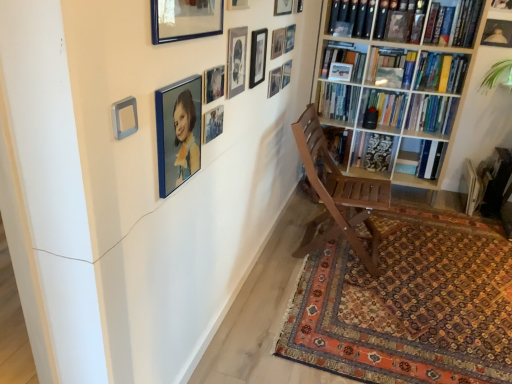
Question: Can you confirm if matte black picture frame at upper center, the 6th picture frame viewed from the right, is wider than matte black picture frame at upper center, which appears as the 12th picture frame when viewed from the left?

Choices:
 (A) no
 (B) yes

Answer: (A)

Question: Is matte black picture frame at upper center, the 6th picture frame viewed from the right, in contact with matte black picture frame at upper center, the third picture frame viewed from the right?

Choices:
 (A) no
 (B) yes

Answer: (A)

Question: Is matte black picture frame at upper center, the 6th picture frame viewed from the right, positioned with its back to matte black picture frame at upper center, which appears as the 12th picture frame when viewed from the left?

Choices:
 (A) yes
 (B) no

Answer: (B)

Question: Is matte black picture frame at upper center, positioned as the ninth picture frame in left-to-right order, completely or partially outside of matte black picture frame at upper center, the third picture frame viewed from the right?

Choices:
 (A) no
 (B) yes

Answer: (B)

Question: Is matte black picture frame at upper center, the 6th picture frame viewed from the right, thinner than matte black picture frame at upper center, the third picture frame viewed from the right?

Choices:
 (A) yes
 (B) no

Answer: (A)

Question: Is matte black picture frame at upper center, the 6th picture frame viewed from the right, positioned before matte black picture frame at upper center, which appears as the 12th picture frame when viewed from the left?

Choices:
 (A) no
 (B) yes

Answer: (B)

Question: Is matte black picture frame at upper center, the third picture frame viewed from the right, thinner than hardcover book at upper right, which appears as the 2th book when ordered from the bottom?

Choices:
 (A) no
 (B) yes

Answer: (B)

Question: Can you confirm if matte black picture frame at upper center, which appears as the 12th picture frame when viewed from the left, is shorter than hardcover book at upper right, which appears as the 2th book when ordered from the bottom?

Choices:
 (A) no
 (B) yes

Answer: (B)

Question: Is hardcover book at upper right, which is the 3th book in top-to-bottom order, inside matte black picture frame at upper center, the third picture frame viewed from the right?

Choices:
 (A) no
 (B) yes

Answer: (A)

Question: From a real-world perspective, is matte black picture frame at upper center, the third picture frame viewed from the right, on hardcover book at upper right, which is the 3th book in top-to-bottom order?

Choices:
 (A) yes
 (B) no

Answer: (A)

Question: Considering the relative sizes of matte black picture frame at upper center, which appears as the 12th picture frame when viewed from the left, and hardcover book at upper right, which is the 3th book in top-to-bottom order, in the image provided, is matte black picture frame at upper center, which appears as the 12th picture frame when viewed from the left, bigger than hardcover book at upper right, which is the 3th book in top-to-bottom order,?

Choices:
 (A) yes
 (B) no

Answer: (B)

Question: From a real-world perspective, is matte black picture frame at upper center, which appears as the 12th picture frame when viewed from the left, positioned under hardcover book at upper right, which is the 3th book in top-to-bottom order, based on gravity?

Choices:
 (A) yes
 (B) no

Answer: (B)

Question: Is blue glossy picture frame at upper center, acting as the 14th picture frame starting from the right, aimed at matte black picture frame at upper center, the 6th picture frame viewed from the right?

Choices:
 (A) no
 (B) yes

Answer: (A)